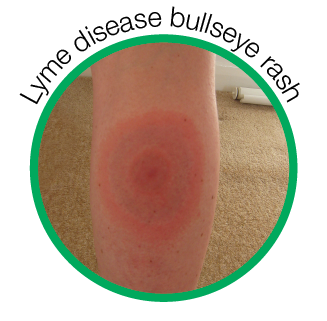
The width and height of the screenshot is (327, 321). Find the location of `carpet`. carpet is located at coordinates (76, 241).